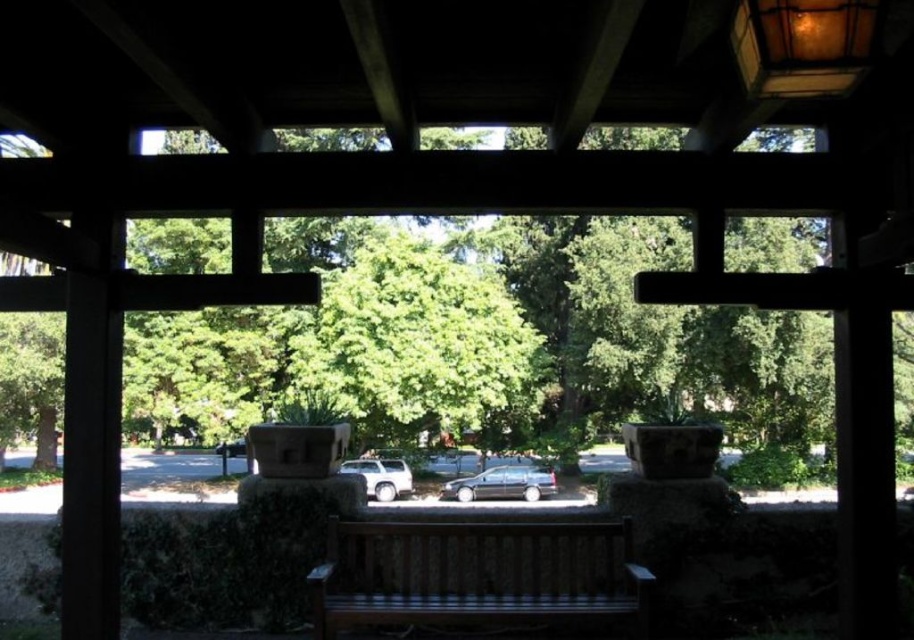
Question: Does green leafy tree at center have a greater width compared to wooden bench at center?

Choices:
 (A) yes
 (B) no

Answer: (A)

Question: Estimate the real-world distances between objects in this image. Which object is farther from the metallic gray car at center?

Choices:
 (A) wooden bench at center
 (B) matte silver suv at center

Answer: (A)

Question: In this image, where is wooden bench at center located relative to matte silver suv at center?

Choices:
 (A) right
 (B) left

Answer: (A)

Question: Which point is farther to the camera?

Choices:
 (A) (464, 484)
 (B) (509, 392)
 (C) (364, 474)
 (D) (426, 577)

Answer: (C)

Question: Where is green leafy tree at center located in relation to metallic gray car at center in the image?

Choices:
 (A) below
 (B) above

Answer: (B)

Question: Based on their relative distances, which object is nearer to the wooden bench at center?

Choices:
 (A) metallic gray car at center
 (B) matte silver suv at center

Answer: (B)